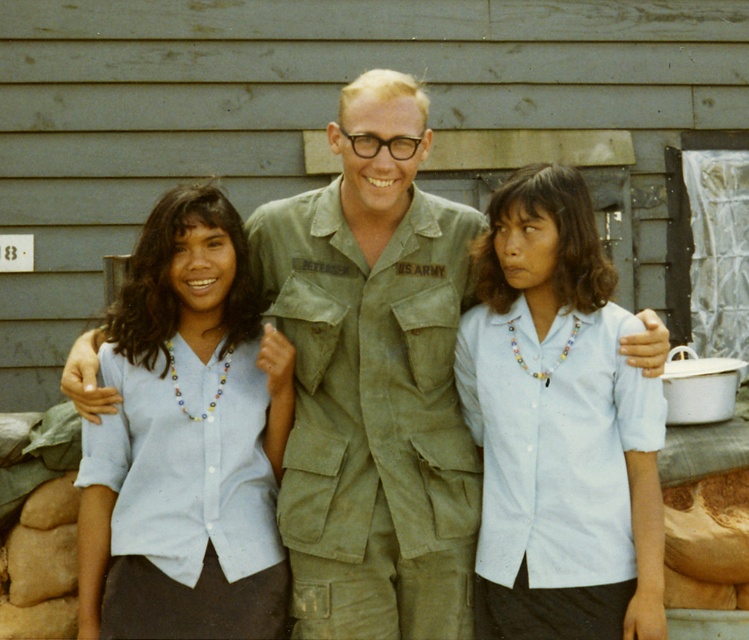
Question: Does green matte uniform at center appear under white matte shirt at center?

Choices:
 (A) no
 (B) yes

Answer: (A)

Question: Does green matte uniform at center come in front of white matte shirt at center?

Choices:
 (A) yes
 (B) no

Answer: (B)

Question: Which of these objects is positioned farthest from the green matte uniform at center?

Choices:
 (A) white matte shirt at center
 (B) light blue cotton shirt at left

Answer: (B)

Question: In this image, where is green matte uniform at center located relative to white matte shirt at center?

Choices:
 (A) below
 (B) above

Answer: (B)

Question: Estimate the real-world distances between objects in this image. Which object is farther from the green matte uniform at center?

Choices:
 (A) light blue cotton shirt at left
 (B) white matte shirt at center

Answer: (A)

Question: Which point appears farthest from the camera in this image?

Choices:
 (A) (115, 520)
 (B) (548, 328)
 (C) (415, 164)

Answer: (B)